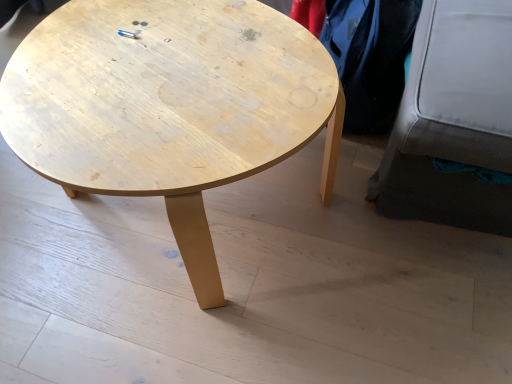
At what (x,y) coordinates should I click in order to perform the action: click on vacant area situated below natural wood coffee table at center (from a real-world perspective). Please return your answer as a coordinate pair (x, y). The height and width of the screenshot is (384, 512). Looking at the image, I should click on (167, 237).